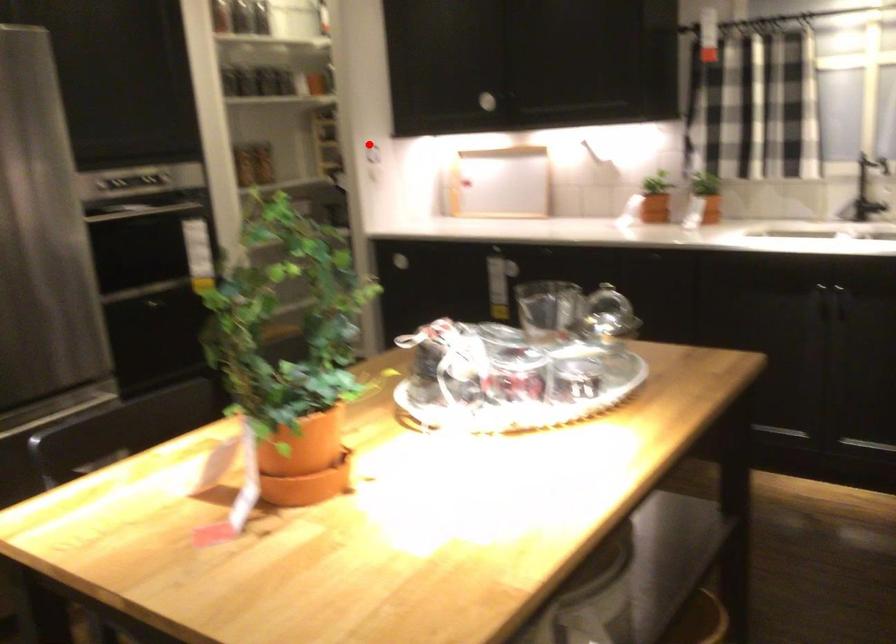
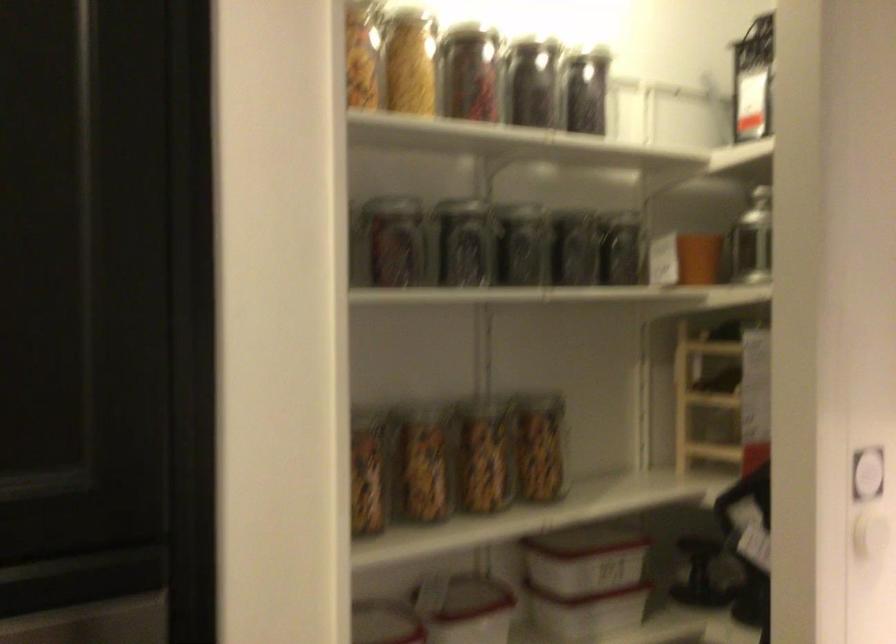
Locate, in the second image, the point that corresponds to the highlighted location in the first image.

(867, 474)